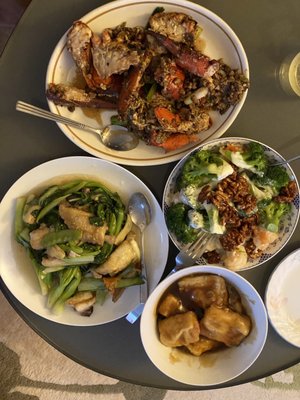
Image resolution: width=300 pixels, height=400 pixels. Identify the location of large bowl. (218, 121).